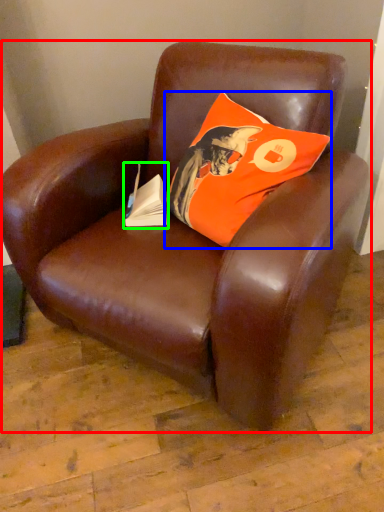
Question: Which is nearer to the chair (highlighted by a red box)? pillow (highlighted by a blue box) or paperback book (highlighted by a green box).

Choices:
 (A) pillow
 (B) paperback book

Answer: (A)